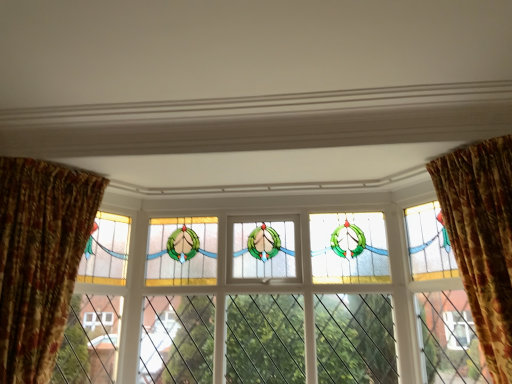
This screenshot has width=512, height=384. Describe the element at coordinates (40, 260) in the screenshot. I see `floral velvet curtain at left, which is the second curtain in right-to-left order` at that location.

At what (x,y) coordinates should I click in order to perform the action: click on stained glass window at center. Please return your answer as a coordinate pair (x, y). The image size is (512, 384). Looking at the image, I should click on (277, 301).

Identify the location of stained glass window at right. Image resolution: width=512 pixels, height=384 pixels. (449, 338).

Which is farther, (453, 290) or (490, 152)?

The point (453, 290) is more distant.

From the picture: Is stained glass window at right not inside floral fabric curtain at right, which is counted as the first curtain, starting from the right?

That's correct, stained glass window at right is outside of floral fabric curtain at right, which is counted as the first curtain, starting from the right.

From a real-world perspective, which is physically above, stained glass window at right or floral fabric curtain at right, which appears as the 2th curtain when viewed from the left?

floral fabric curtain at right, which appears as the 2th curtain when viewed from the left, from a real-world perspective.

Which is more to the left, stained glass window at right or floral fabric curtain at right, which appears as the 2th curtain when viewed from the left?

Positioned to the left is stained glass window at right.

Can you tell me how much floral fabric curtain at right, which appears as the 2th curtain when viewed from the left, and floral velvet curtain at left, acting as the 1th curtain starting from the left, differ in facing direction?

The angle between the facing direction of floral fabric curtain at right, which appears as the 2th curtain when viewed from the left, and the facing direction of floral velvet curtain at left, acting as the 1th curtain starting from the left, is 68.5 degrees.

Locate an element on the screen. The image size is (512, 384). curtain below the floral fabric curtain at right, which appears as the 2th curtain when viewed from the left (from the image's perspective) is located at coordinates (40, 260).

Is point (511, 375) closer to camera compared to point (24, 371)?

Yes, point (511, 375) is in front of point (24, 371).

Between floral fabric curtain at right, which appears as the 2th curtain when viewed from the left, and floral velvet curtain at left, acting as the 1th curtain starting from the left, which one has larger size?

Bigger between the two is floral fabric curtain at right, which appears as the 2th curtain when viewed from the left.

From a real-world perspective, who is located lower, stained glass window at center or floral fabric curtain at right, which appears as the 2th curtain when viewed from the left?

stained glass window at center.

Considering the sizes of objects stained glass window at center and floral fabric curtain at right, which appears as the 2th curtain when viewed from the left, in the image provided, who is wider, stained glass window at center or floral fabric curtain at right, which appears as the 2th curtain when viewed from the left,?

Wider between the two is floral fabric curtain at right, which appears as the 2th curtain when viewed from the left.

Relative to floral fabric curtain at right, which appears as the 2th curtain when viewed from the left, is stained glass window at center in front or behind?

In the image, stained glass window at center appears behind floral fabric curtain at right, which appears as the 2th curtain when viewed from the left.

From the image's perspective, between floral fabric curtain at right, which is counted as the first curtain, starting from the right, and stained glass window at right, which one is located above?

From the image's view, floral fabric curtain at right, which is counted as the first curtain, starting from the right, is above.

Would you say stained glass window at right is part of floral fabric curtain at right, which is counted as the first curtain, starting from the right,'s contents?

Actually, stained glass window at right is outside floral fabric curtain at right, which is counted as the first curtain, starting from the right.

How many degrees apart are the facing directions of floral fabric curtain at right, which appears as the 2th curtain when viewed from the left, and stained glass window at right?

They differ by 154 degrees in their facing directions.

Is floral fabric curtain at right, which is counted as the first curtain, starting from the right, with stained glass window at right?

There is a gap between floral fabric curtain at right, which is counted as the first curtain, starting from the right, and stained glass window at right.

From a real-world perspective, is floral fabric curtain at right, which is counted as the first curtain, starting from the right, positioned over stained glass window at center based on gravity?

Yes, from a real-world perspective, floral fabric curtain at right, which is counted as the first curtain, starting from the right, is over stained glass window at center

Looking at this image, which is more to the left, floral fabric curtain at right, which is counted as the first curtain, starting from the right, or stained glass window at center?

stained glass window at center is more to the left.

Measure the distance between floral fabric curtain at right, which is counted as the first curtain, starting from the right, and stained glass window at center.

floral fabric curtain at right, which is counted as the first curtain, starting from the right, and stained glass window at center are 37.01 inches apart from each other.

From the image's perspective, is floral fabric curtain at right, which is counted as the first curtain, starting from the right, located above or below stained glass window at center?

From the image's perspective, floral fabric curtain at right, which is counted as the first curtain, starting from the right, appears above stained glass window at center.

From a real-world perspective, is stained glass window at right on top of stained glass window at center?

Correct, in the physical world, stained glass window at right is higher than stained glass window at center.

From the image's perspective, would you say stained glass window at right is positioned over stained glass window at center?

Indeed, from the image's perspective, stained glass window at right is shown above stained glass window at center.

Who is shorter, stained glass window at right or stained glass window at center?

Standing shorter between the two is stained glass window at right.

Considering the sizes of objects stained glass window at right and stained glass window at center in the image provided, who is thinner, stained glass window at right or stained glass window at center?

Thinner between the two is stained glass window at right.

Can you confirm if stained glass window at center is positioned to the right of floral velvet curtain at left, which is the second curtain in right-to-left order?

Yes.

Considering the positions of point (428, 210) and point (17, 210), is point (428, 210) closer or farther from the camera than point (17, 210)?

Point (428, 210).

Looking at their sizes, would you say stained glass window at center is wider or thinner than floral velvet curtain at left, which is the second curtain in right-to-left order?

stained glass window at center is thinner than floral velvet curtain at left, which is the second curtain in right-to-left order.

Locate an element on the screen. This screenshot has width=512, height=384. window on the right of floral velvet curtain at left, which is the second curtain in right-to-left order is located at coordinates (277, 301).

Locate an element on the screen. glass door on the left of floral fabric curtain at right, which appears as the 2th curtain when viewed from the left is located at coordinates (449, 338).

In order to click on curtain on the right of floral velvet curtain at left, which is the second curtain in right-to-left order in this screenshot , I will do `click(482, 239)`.

From the picture: Which object lies further to the anchor point floral velvet curtain at left, which is the second curtain in right-to-left order, stained glass window at right or stained glass window at center?

The object further to floral velvet curtain at left, which is the second curtain in right-to-left order, is stained glass window at right.

From the picture: When comparing their distances from floral velvet curtain at left, acting as the 1th curtain starting from the left, does floral fabric curtain at right, which is counted as the first curtain, starting from the right, or stained glass window at center seem further?

floral fabric curtain at right, which is counted as the first curtain, starting from the right, is positioned further to the anchor floral velvet curtain at left, acting as the 1th curtain starting from the left.

Based on their spatial positions, is floral velvet curtain at left, acting as the 1th curtain starting from the left, or stained glass window at center further from stained glass window at right?

floral velvet curtain at left, acting as the 1th curtain starting from the left.

Based on their spatial positions, is stained glass window at center or stained glass window at right closer to floral velvet curtain at left, which is the second curtain in right-to-left order?

The object closer to floral velvet curtain at left, which is the second curtain in right-to-left order, is stained glass window at center.

Looking at the image, which one is located closer to floral fabric curtain at right, which is counted as the first curtain, starting from the right, stained glass window at right or stained glass window at center?

stained glass window at right lies closer to floral fabric curtain at right, which is counted as the first curtain, starting from the right, than the other object.

Looking at this image, looking at the image, which one is located closer to stained glass window at center, stained glass window at right or floral fabric curtain at right, which appears as the 2th curtain when viewed from the left?

Among the two, stained glass window at right is located nearer to stained glass window at center.

Considering their positions, is floral velvet curtain at left, which is the second curtain in right-to-left order, positioned closer to stained glass window at center than stained glass window at right?

stained glass window at right is closer to stained glass window at center.

Considering their positions, is floral velvet curtain at left, acting as the 1th curtain starting from the left, positioned closer to floral fabric curtain at right, which appears as the 2th curtain when viewed from the left, than stained glass window at right?

Based on the image, stained glass window at right appears to be nearer to floral fabric curtain at right, which appears as the 2th curtain when viewed from the left.

Locate an element on the screen. The height and width of the screenshot is (384, 512). window between floral velvet curtain at left, which is the second curtain in right-to-left order, and stained glass window at right from left to right is located at coordinates (277, 301).

This screenshot has width=512, height=384. I want to click on glass door between stained glass window at center and floral fabric curtain at right, which is counted as the first curtain, starting from the right, from left to right, so click(x=449, y=338).

Locate an element on the screen. The width and height of the screenshot is (512, 384). window between floral velvet curtain at left, which is the second curtain in right-to-left order, and floral fabric curtain at right, which is counted as the first curtain, starting from the right is located at coordinates click(277, 301).

At what (x,y) coordinates should I click in order to perform the action: click on glass door located between floral velvet curtain at left, acting as the 1th curtain starting from the left, and floral fabric curtain at right, which is counted as the first curtain, starting from the right, in the left-right direction. Please return your answer as a coordinate pair (x, y). Looking at the image, I should click on (449, 338).